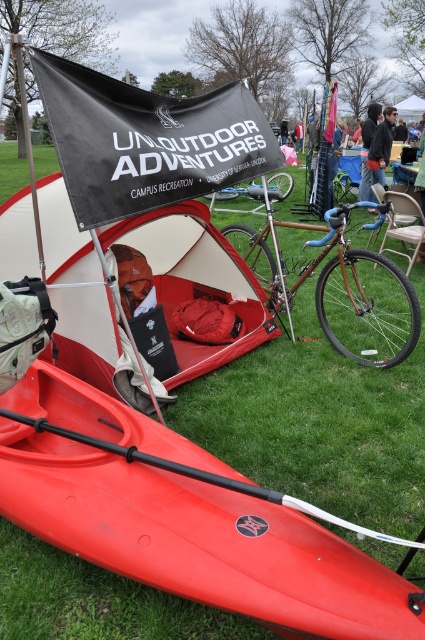
Question: Estimate the real-world distances between objects in this image. Which object is farther from the matte red tent at center?

Choices:
 (A) dark gray hoodie at upper right
 (B) brown leather jacket at center
 (C) black rubber paddle at lower left
 (D) black fabric flag at upper center

Answer: (B)

Question: Can you confirm if matte red tent at center is smaller than dark gray hoodie at upper right?

Choices:
 (A) yes
 (B) no

Answer: (B)

Question: Is black rubber paddle at lower left below dark gray hoodie at upper right?

Choices:
 (A) no
 (B) yes

Answer: (B)

Question: Which point is closer to the camera taking this photo?

Choices:
 (A) (419, 108)
 (B) (190, 474)
 (C) (274, 198)
 (D) (299, 148)

Answer: (B)

Question: Where is wooden frame bicycle at right located in relation to black rubber paddle at lower left in the image?

Choices:
 (A) right
 (B) left

Answer: (A)

Question: Which of the following is the closest to the observer?

Choices:
 (A) wooden frame bicycle at center
 (B) black fabric flag at upper center
 (C) matte red tent at center

Answer: (B)